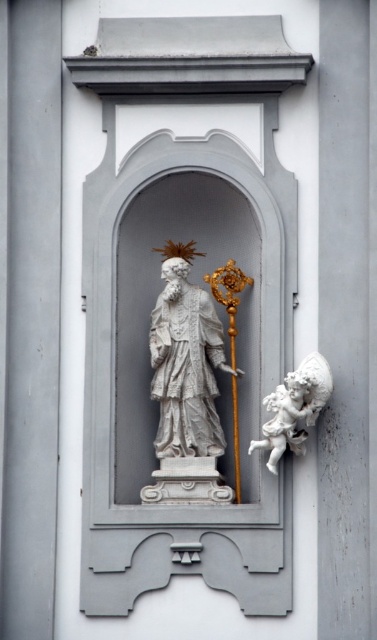
Question: Considering the relative positions of white marble statue at center and white marble cherub at lower right in the image provided, where is white marble statue at center located with respect to white marble cherub at lower right?

Choices:
 (A) right
 (B) left

Answer: (B)

Question: Considering the relative positions of white marble statue at center and white marble cherub at lower right in the image provided, where is white marble statue at center located with respect to white marble cherub at lower right?

Choices:
 (A) above
 (B) below

Answer: (A)

Question: Which point appears farthest from the camera in this image?

Choices:
 (A) (173, 356)
 (B) (271, 458)

Answer: (A)

Question: Which of the following is the closest to the observer?

Choices:
 (A) white marble cherub at lower right
 (B) white marble statue at center

Answer: (A)

Question: Can you confirm if white marble statue at center is thinner than white marble cherub at lower right?

Choices:
 (A) no
 (B) yes

Answer: (A)

Question: Which of the following is the farthest from the observer?

Choices:
 (A) white marble statue at center
 (B) white marble cherub at lower right

Answer: (A)